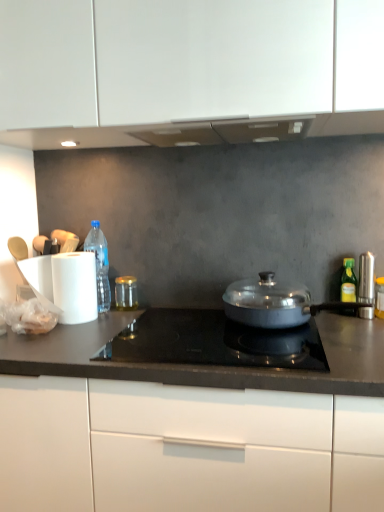
Find the location of a particular element. This screenshot has height=512, width=384. vacant region under metallic gray pan at center (from a real-world perspective) is located at coordinates (301, 327).